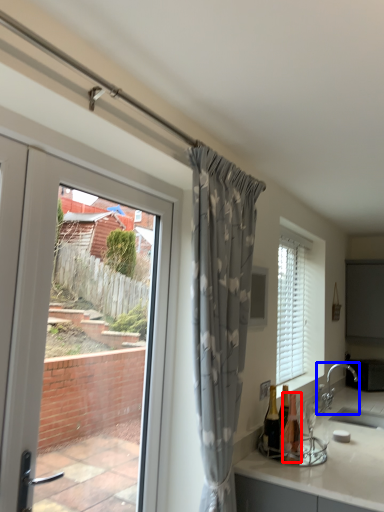
Question: Which of the following is the farthest to the observer, bottle (highlighted by a red box) or tap (highlighted by a blue box)?

Choices:
 (A) bottle
 (B) tap

Answer: (B)